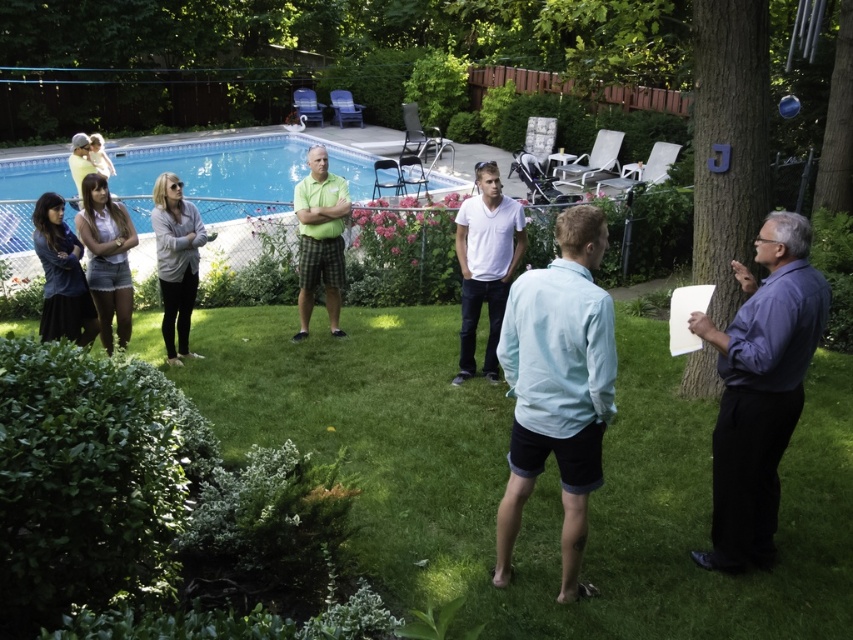
Question: Which object appears closest to the camera in this image?

Choices:
 (A) denim jacket at lower left
 (B) green matte shirt at center
 (C) gray matte sweater at center
 (D) green grass at center

Answer: (D)

Question: Which point appears farthest from the camera in this image?

Choices:
 (A) (479, 280)
 (B) (18, 237)
 (C) (502, 504)

Answer: (B)

Question: Is light blue cotton shirt at center above gray matte sweater at center?

Choices:
 (A) no
 (B) yes

Answer: (A)

Question: Does purple shirt at right appear over denim shorts at left?

Choices:
 (A) yes
 (B) no

Answer: (B)

Question: Is green grass at center above blue tile swimming pool at upper left?

Choices:
 (A) no
 (B) yes

Answer: (A)

Question: Among these objects, which one is farthest from the camera?

Choices:
 (A) green matte shirt at center
 (B) light blue cotton shirt at center
 (C) gray matte sweater at center

Answer: (A)